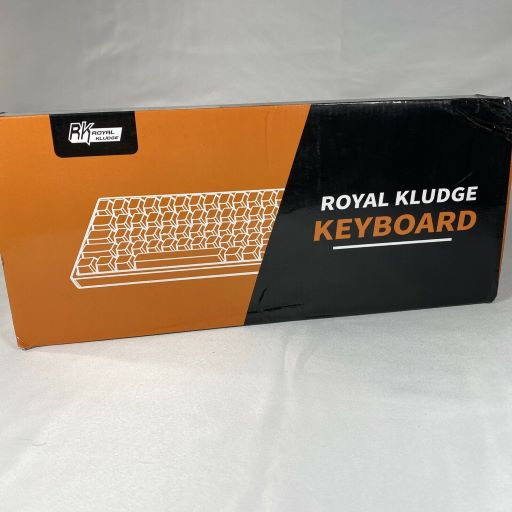
Locate an element on the screen. keyboard pic is located at coordinates (226, 258).